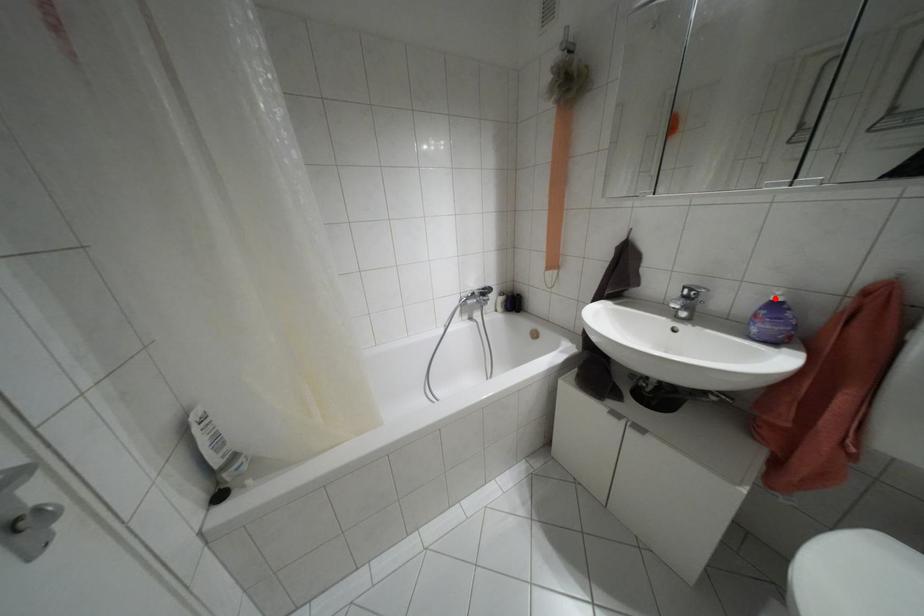
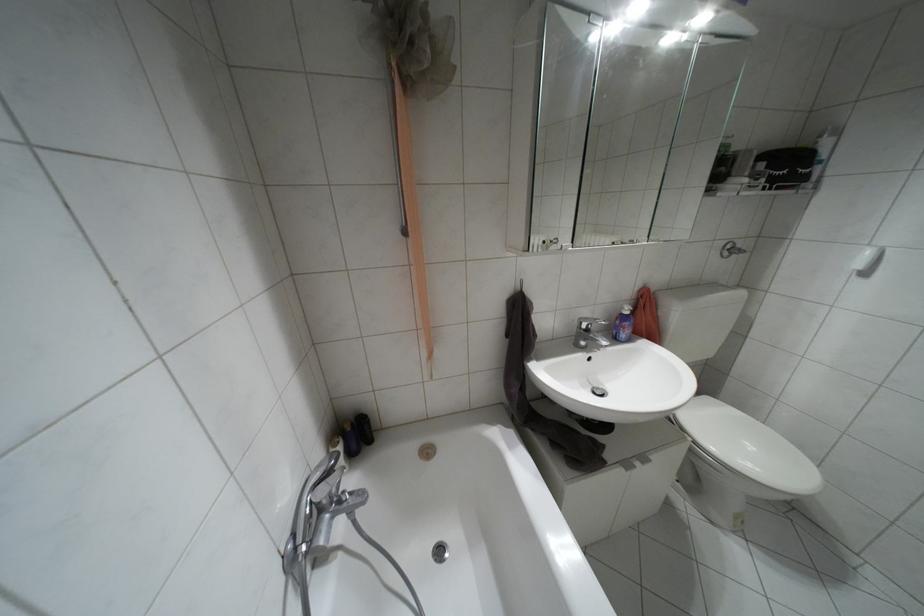
In the second image, find the point that corresponds to the highlighted location in the first image.

(626, 312)